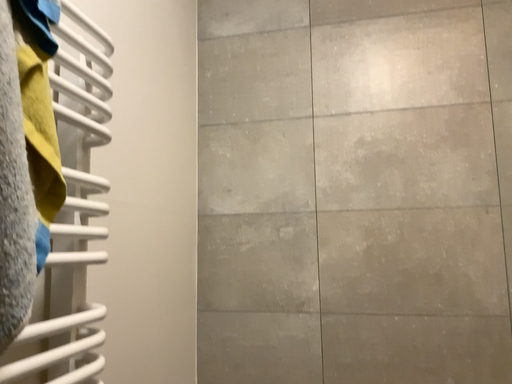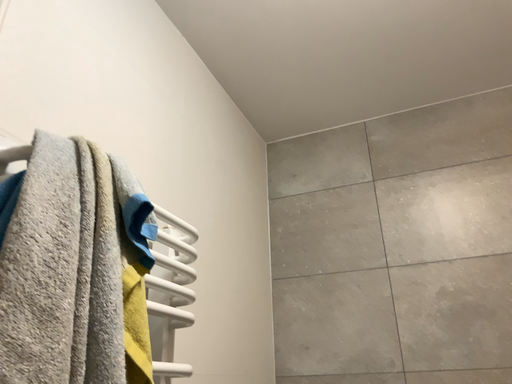
Question: Which way did the camera rotate in the video?

Choices:
 (A) rotated left
 (B) rotated right

Answer: (A)